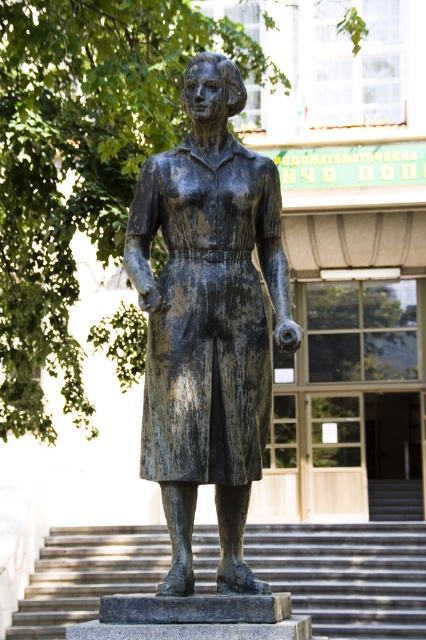
Question: Is bronze statue at center further to camera compared to smooth concrete stairs at center?

Choices:
 (A) yes
 (B) no

Answer: (B)

Question: Can you confirm if bronze statue at center is positioned to the right of smooth concrete stairs at center?

Choices:
 (A) yes
 (B) no

Answer: (B)

Question: Among these points, which one is nearest to the camera?

Choices:
 (A) (204, 184)
 (B) (66, 532)

Answer: (A)

Question: Is bronze statue at center thinner than smooth concrete stairs at center?

Choices:
 (A) no
 (B) yes

Answer: (B)